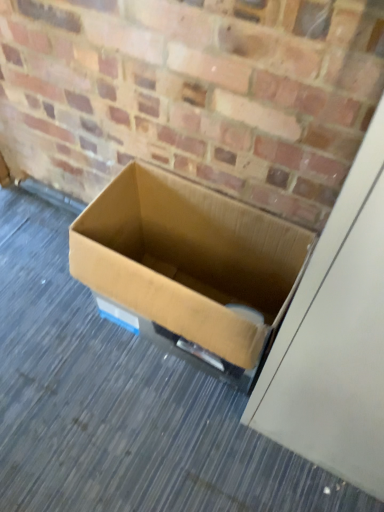
Question: Choose the correct answer: Is brown cardboard box at center inside brown cardboard box at center or outside it?

Choices:
 (A) outside
 (B) inside

Answer: (A)

Question: Considering the relative positions of brown cardboard box at center and brown cardboard box at center in the image provided, is brown cardboard box at center to the left or to the right of brown cardboard box at center?

Choices:
 (A) left
 (B) right

Answer: (A)

Question: Looking at the image, does brown cardboard box at center seem bigger or smaller compared to brown cardboard box at center?

Choices:
 (A) big
 (B) small

Answer: (B)

Question: Is brown cardboard box at center inside or outside of brown cardboard box at center?

Choices:
 (A) outside
 (B) inside

Answer: (A)

Question: From a real-world perspective, is brown cardboard box at center positioned above or below brown cardboard box at center?

Choices:
 (A) above
 (B) below

Answer: (A)

Question: In the image, is brown cardboard box at center positioned in front of or behind brown cardboard box at center?

Choices:
 (A) behind
 (B) front

Answer: (B)

Question: From the image's perspective, is brown cardboard box at center located above or below brown cardboard box at center?

Choices:
 (A) above
 (B) below

Answer: (A)